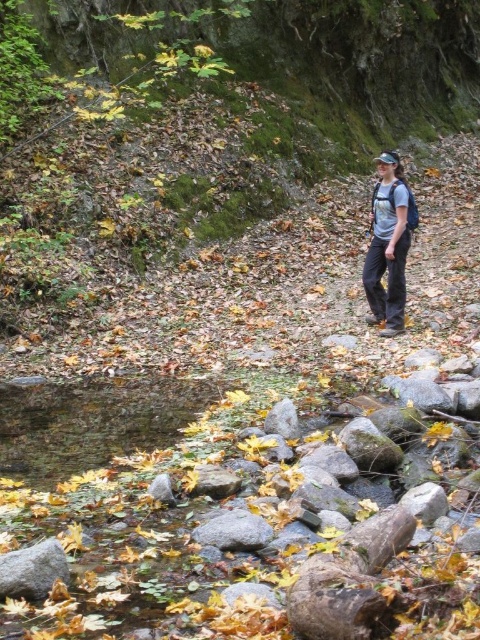
You are standing in the autumn forest scene and see the green mossy hillside at center and the matte gray shirt at center. Which object is higher in elevation?

The green mossy hillside at center is taller than the matte gray shirt at center, so the green mossy hillside at center is higher in elevation.